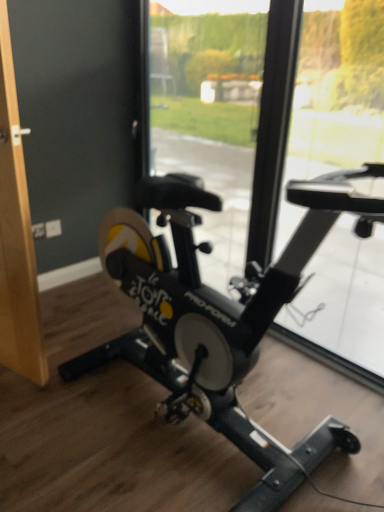
You are a GUI agent. You are given a task and a screenshot of the screen. Output one action in this format:
    pyautogui.click(x=<x>, y=<y>)
    Task: Click on the vacant space to the right of wooden door handle at left
    This screenshot has height=512, width=384.
    Given the screenshot: What is the action you would take?
    pyautogui.click(x=82, y=390)